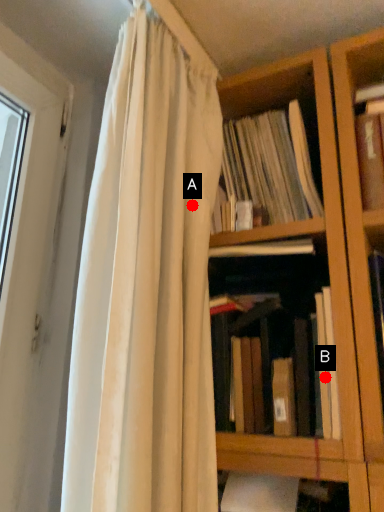
Question: Two points are circled on the image, labeled by A and B beside each circle. Which point is farther to the camera?

Choices:
 (A) A is further
 (B) B is further

Answer: (A)